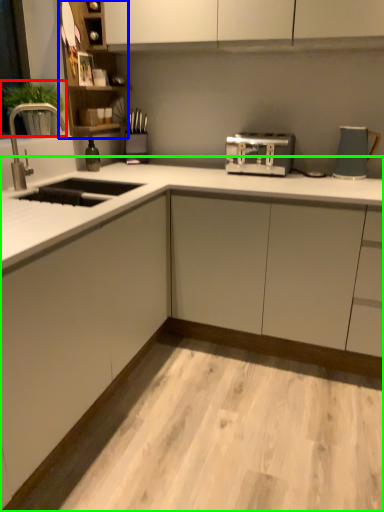
Question: Considering the real-world distances, which object is farthest from plant (highlighted by a red box)? cabinet (highlighted by a blue box) or countertop (highlighted by a green box)?

Choices:
 (A) cabinet
 (B) countertop

Answer: (B)